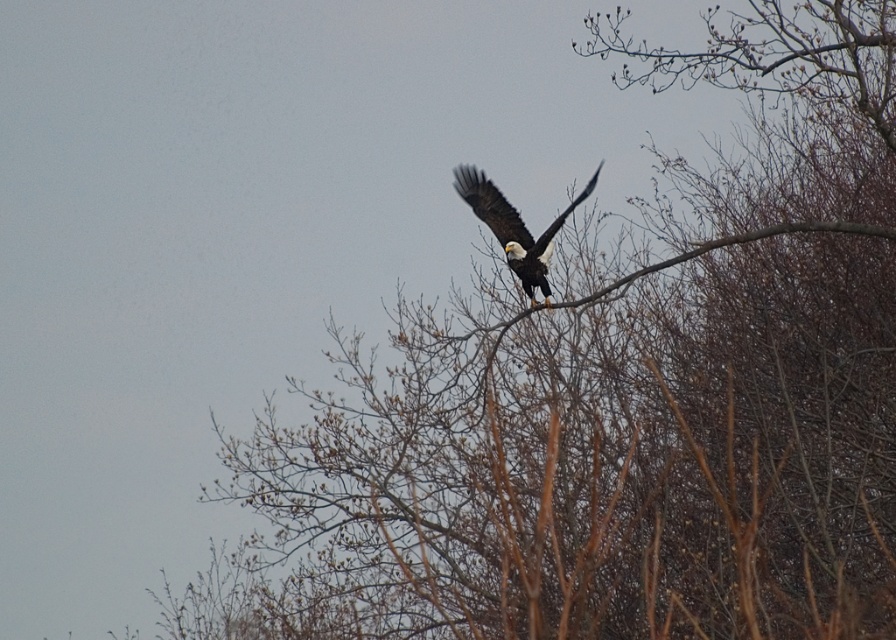
Question: Is white-feathered bald eagle at center in front of brown wood tree branch at center?

Choices:
 (A) no
 (B) yes

Answer: (A)

Question: Among these points, which one is nearest to the camera?

Choices:
 (A) (457, 342)
 (B) (546, 259)

Answer: (B)

Question: Is white-feathered bald eagle at center to the right of brown wood tree branch at center from the viewer's perspective?

Choices:
 (A) no
 (B) yes

Answer: (A)

Question: Which point is farther from the camera taking this photo?

Choices:
 (A) (475, 180)
 (B) (448, 337)

Answer: (B)

Question: Is white-feathered bald eagle at center smaller than brown wood tree branch at center?

Choices:
 (A) no
 (B) yes

Answer: (B)